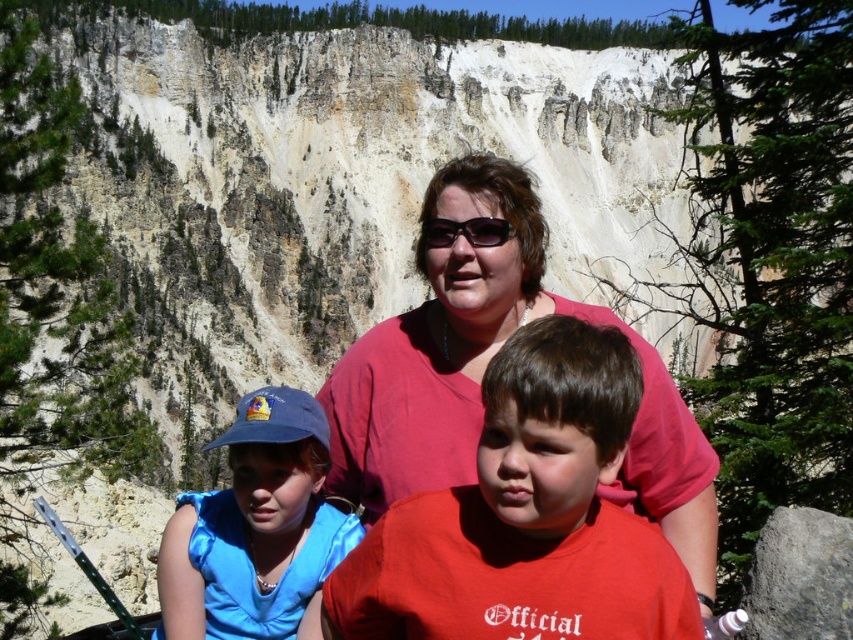
Question: In this image, where is gray rough rock at lower right located relative to matte black sunglasses at center?

Choices:
 (A) right
 (B) left

Answer: (A)

Question: Which object is positioned closest to the gray rough rock at lower right?

Choices:
 (A) blue satin cap at left
 (B) matte black sunglasses at center
 (C) red matte shirt at center

Answer: (C)

Question: Which of the following is the closest to the observer?

Choices:
 (A) blue satin cap at left
 (B) matte black sunglasses at center
 (C) gray rough rock at lower right
 (D) red matte shirt at center

Answer: (D)

Question: Does gray rough rock at lower right appear on the right side of matte black sunglasses at center?

Choices:
 (A) no
 (B) yes

Answer: (B)

Question: Does gray rough rock at lower right appear under matte black sunglasses at center?

Choices:
 (A) yes
 (B) no

Answer: (A)

Question: Which point appears closest to the camera in this image?

Choices:
 (A) (424, 248)
 (B) (827, 557)
 (C) (224, 552)

Answer: (B)